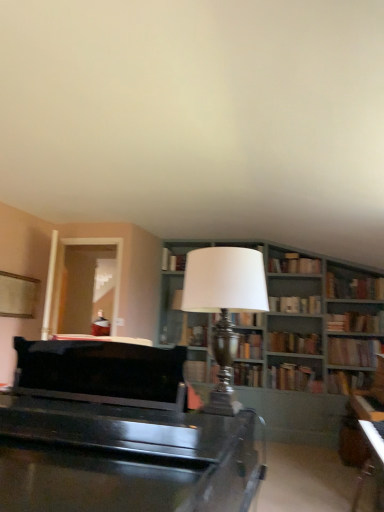
Question: Is silver metallic table lamp at center further to camera compared to hardcover book at center, marked as the sixth book in a bottom-to-top arrangement?

Choices:
 (A) yes
 (B) no

Answer: (B)

Question: Is silver metallic table lamp at center positioned with its back to hardcover book at center, the eighth book in the top-to-bottom sequence?

Choices:
 (A) yes
 (B) no

Answer: (B)

Question: Considering the relative sizes of silver metallic table lamp at center and hardcover book at center, marked as the sixth book in a bottom-to-top arrangement, in the image provided, is silver metallic table lamp at center taller than hardcover book at center, marked as the sixth book in a bottom-to-top arrangement,?

Choices:
 (A) yes
 (B) no

Answer: (A)

Question: Considering the relative sizes of silver metallic table lamp at center and hardcover book at center, the eighth book in the top-to-bottom sequence, in the image provided, is silver metallic table lamp at center shorter than hardcover book at center, the eighth book in the top-to-bottom sequence,?

Choices:
 (A) no
 (B) yes

Answer: (A)

Question: Can you confirm if silver metallic table lamp at center is smaller than hardcover book at center, the eighth book in the top-to-bottom sequence?

Choices:
 (A) yes
 (B) no

Answer: (B)

Question: Does silver metallic table lamp at center have a greater width compared to hardcover book at center, the eighth book in the top-to-bottom sequence?

Choices:
 (A) yes
 (B) no

Answer: (A)

Question: Can you confirm if hardcover book at center, positioned as the 9th book in top-to-bottom order, is taller than hardcover book at center, the 7th book from the bottom?

Choices:
 (A) no
 (B) yes

Answer: (A)

Question: Does hardcover book at center, positioned as the 9th book in top-to-bottom order, appear on the right side of hardcover book at center, which is counted as the seventh book, starting from the top?

Choices:
 (A) no
 (B) yes

Answer: (B)

Question: From the image's perspective, does hardcover book at center, positioned as the 9th book in top-to-bottom order, appear higher than hardcover book at center, the 7th book from the bottom?

Choices:
 (A) no
 (B) yes

Answer: (A)

Question: Is hardcover book at center, which ranks as the fifth book in bottom-to-top order, oriented away from hardcover book at center, the 7th book from the bottom?

Choices:
 (A) no
 (B) yes

Answer: (A)

Question: Considering the relative sizes of hardcover book at center, which ranks as the fifth book in bottom-to-top order, and hardcover book at center, the 7th book from the bottom, in the image provided, is hardcover book at center, which ranks as the fifth book in bottom-to-top order, shorter than hardcover book at center, the 7th book from the bottom,?

Choices:
 (A) yes
 (B) no

Answer: (A)

Question: Considering the relative sizes of clear glass door at left and hardcover book at upper right, marked as the ninth book in a bottom-to-top arrangement, in the image provided, is clear glass door at left bigger than hardcover book at upper right, marked as the ninth book in a bottom-to-top arrangement,?

Choices:
 (A) no
 (B) yes

Answer: (B)